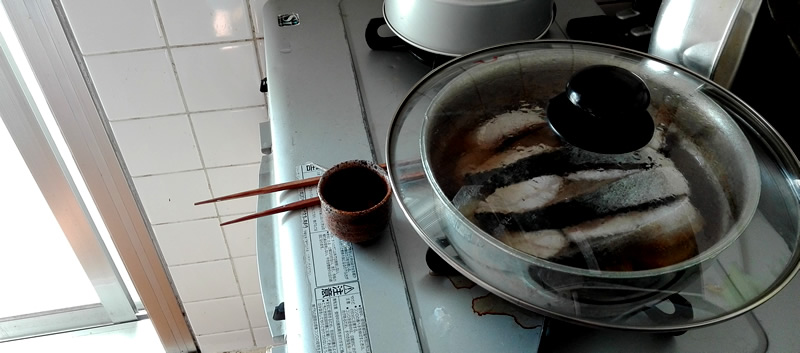
At what (x,y) coordinates should I click in order to perform the action: click on burner. Please return your answer as a coordinate pair (x, y). The height and width of the screenshot is (353, 800). Looking at the image, I should click on (490, 315), (390, 54).